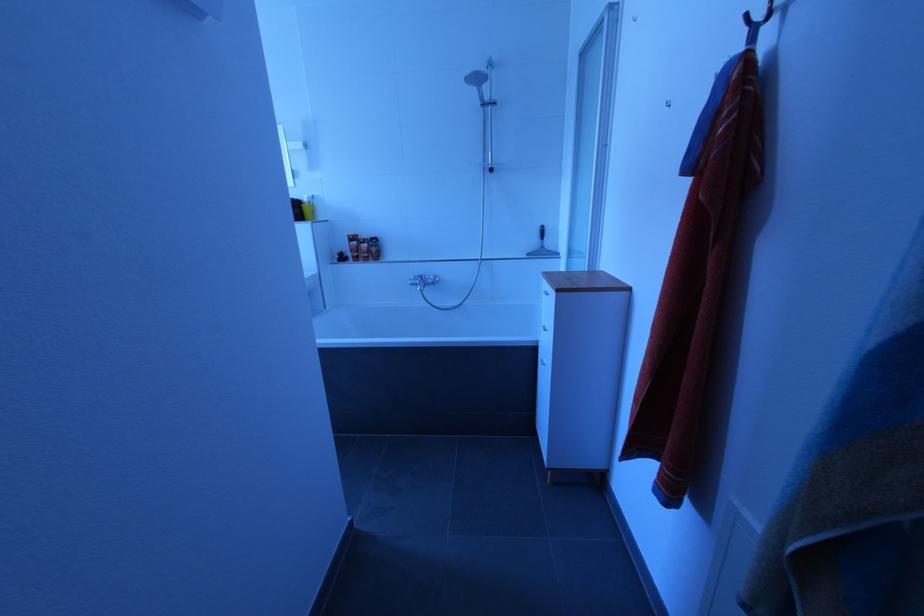
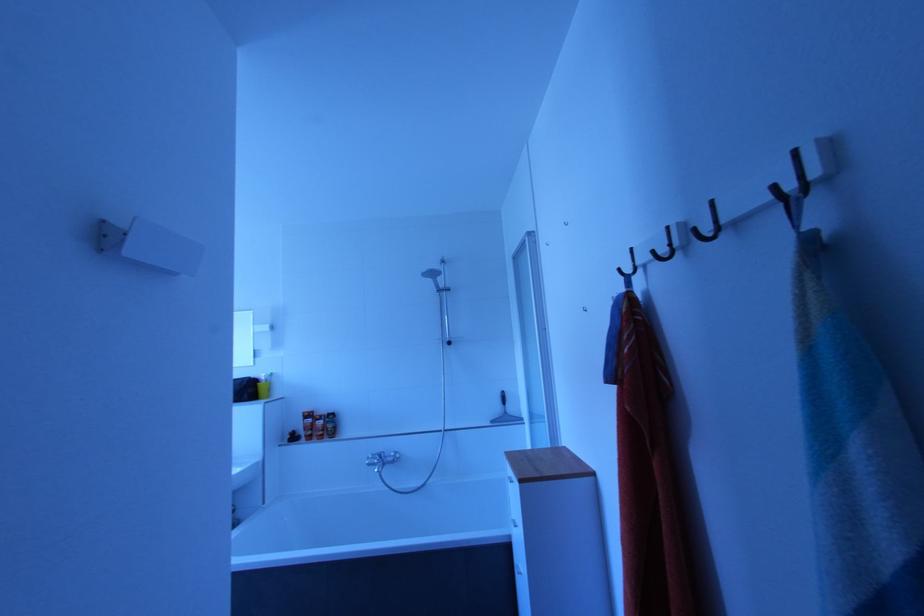
Question: The images are taken continuously from a first-person perspective. In which direction is your viewpoint rotating?

Choices:
 (A) Left
 (B) Right
 (C) Up
 (D) Down

Answer: (C)